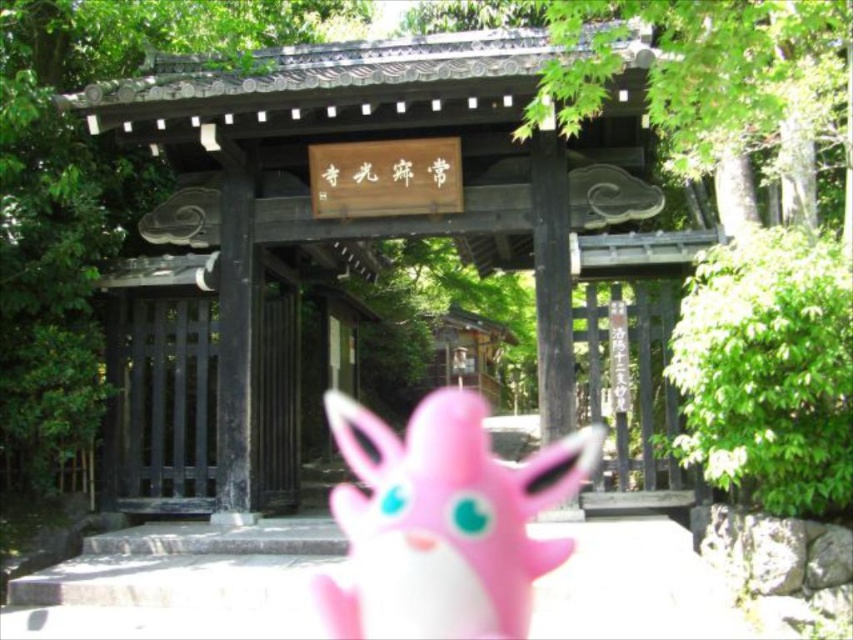
Consider the image. Can you confirm if pink rubber toy at center is shorter than black wooden gate at center?

Yes.

Who is higher up, pink rubber toy at center or black wooden gate at center?

black wooden gate at center is above.

Is point (579, 476) closer to viewer compared to point (253, 317)?

No, (579, 476) is behind (253, 317).

Find the location of a particular element. pink rubber toy at center is located at coordinates (444, 522).